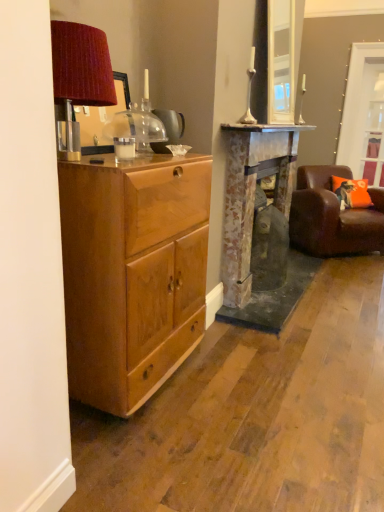
Question: Considering the positions of matte wood cabinet at left and clear glass door at upper right in the image, is matte wood cabinet at left taller or shorter than clear glass door at upper right?

Choices:
 (A) tall
 (B) short

Answer: (B)

Question: Is matte wood cabinet at left wider or thinner than clear glass door at upper right?

Choices:
 (A) thin
 (B) wide

Answer: (B)

Question: Considering the real-world distances, which object is farthest from the rustic stone fireplace at center?

Choices:
 (A) matte wood cabinet at left
 (B) orange fabric pillow at right
 (C) brown leather chair at right
 (D) clear glass door at upper right

Answer: (D)

Question: Which of these objects is positioned farthest from the brown leather chair at right?

Choices:
 (A) rustic stone fireplace at center
 (B) matte wood cabinet at left
 (C) clear glass door at upper right
 (D) orange fabric pillow at right

Answer: (B)